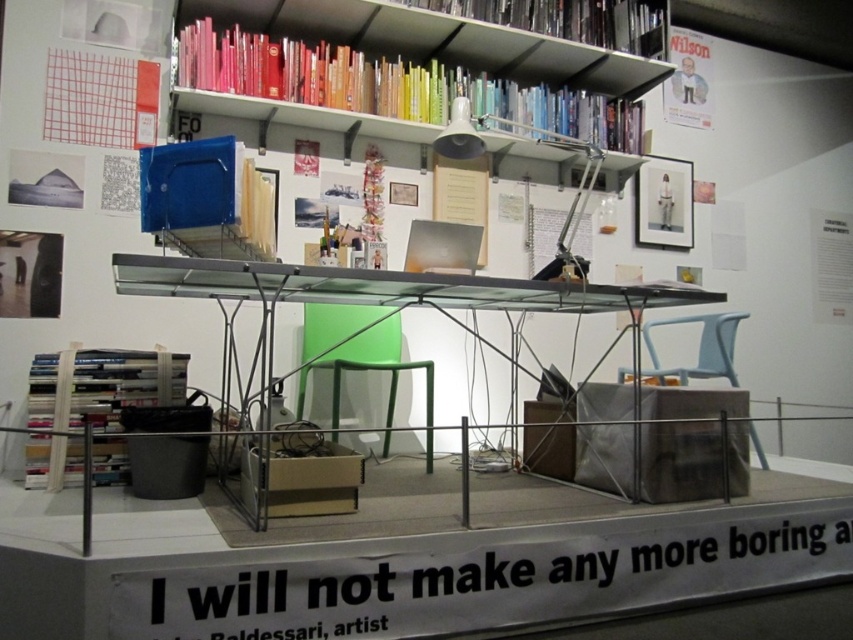
Question: Is the position of hardcover books at upper center more distant than that of hardcover books at lower left?

Choices:
 (A) no
 (B) yes

Answer: (B)

Question: Which of the following is the closest to the observer?

Choices:
 (A) (399, 115)
 (B) (581, 29)
 (C) (671, 202)
 (D) (73, 426)

Answer: (D)

Question: Among these objects, which one is nearest to the camera?

Choices:
 (A) hardcover book at upper center
 (B) hardcover books at lower left
 (C) transparent glass table at center
 (D) hardcover books at upper center

Answer: (C)

Question: Can you confirm if transparent glass table at center is positioned above hardcover books at lower left?

Choices:
 (A) yes
 (B) no

Answer: (A)

Question: Observing the image, what is the correct spatial positioning of hardcover books at upper center in reference to hardcover books at lower left?

Choices:
 (A) above
 (B) below

Answer: (A)

Question: Which of the following is the farthest from the observer?

Choices:
 (A) hardcover books at lower left
 (B) hardcover books at upper center
 (C) hardcover book at upper center

Answer: (C)